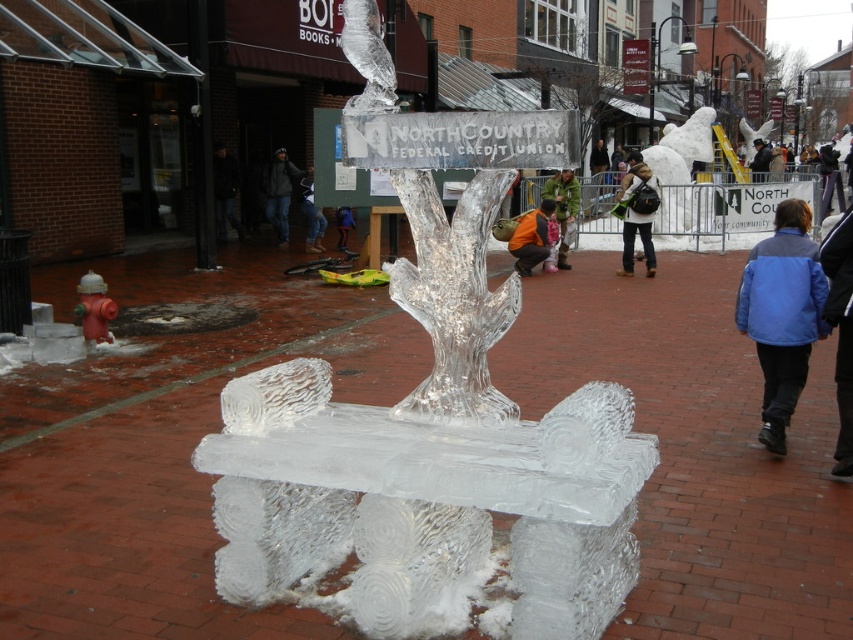
Can you confirm if blue fabric jacket at lower right is shorter than matte blue jacket at center?

Incorrect, blue fabric jacket at lower right's height does not fall short of matte blue jacket at center's.

Can you confirm if blue fabric jacket at lower right is smaller than matte blue jacket at center?

No.

Is point (840, 404) behind point (341, 212)?

That is False.

Image resolution: width=853 pixels, height=640 pixels. I want to click on blue fabric jacket at lower right, so click(x=840, y=330).

Is blue fabric jacket at lower right wider than black leather jacket at upper center?

No, blue fabric jacket at lower right is not wider than black leather jacket at upper center.

Can you confirm if blue fabric jacket at lower right is taller than black leather jacket at upper center?

No, blue fabric jacket at lower right is not taller than black leather jacket at upper center.

Describe the element at coordinates (840, 330) in the screenshot. I see `blue fabric jacket at lower right` at that location.

Where is `blue fabric jacket at lower right`? This screenshot has height=640, width=853. blue fabric jacket at lower right is located at coordinates (840, 330).

Does blue denim jeans at center have a lesser height compared to matte blue jacket at center?

In fact, blue denim jeans at center may be taller than matte blue jacket at center.

Between blue denim jeans at center and matte blue jacket at center, which one appears on the right side from the viewer's perspective?

matte blue jacket at center is more to the right.

This screenshot has width=853, height=640. What do you see at coordinates (312, 216) in the screenshot?
I see `blue denim jeans at center` at bounding box center [312, 216].

Where is `blue denim jeans at center`? This screenshot has width=853, height=640. blue denim jeans at center is located at coordinates (312, 216).